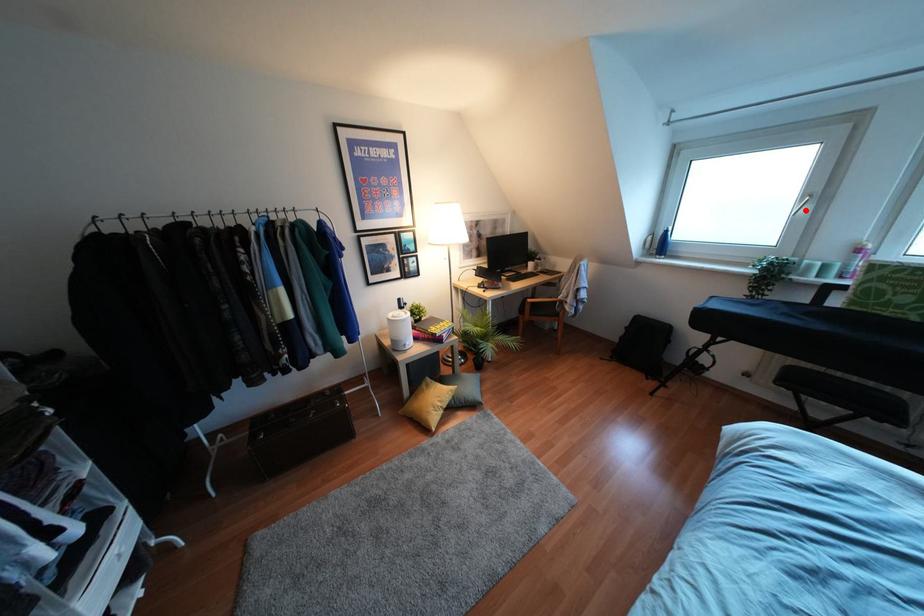
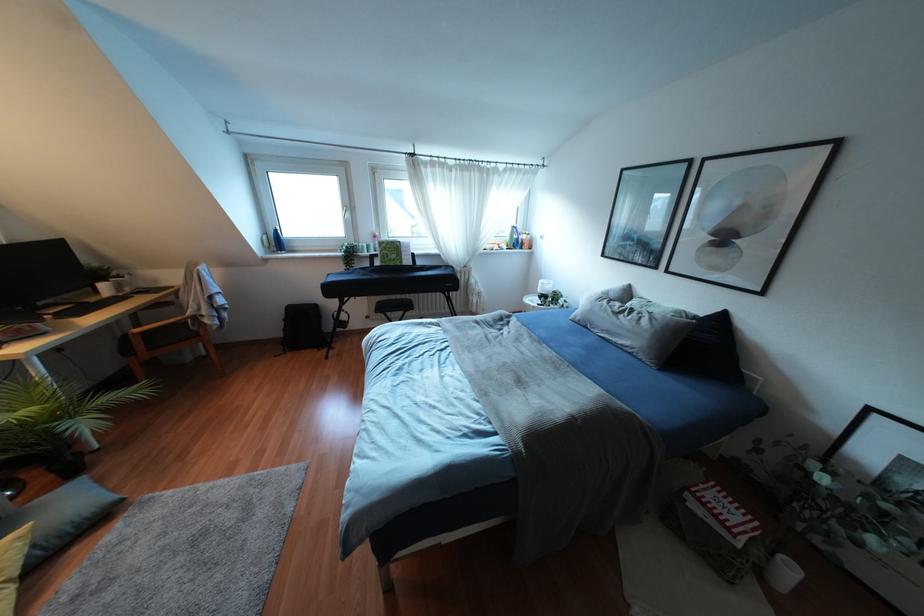
Find the pixel in the second image that matches the highlighted location in the first image.

(346, 215)